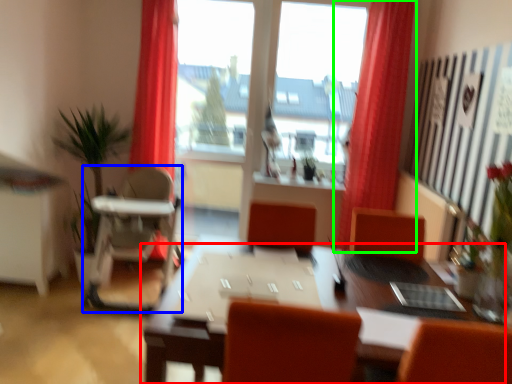
Question: Considering the real-world distances, which object is farthest from table (highlighted by a red box)? armchair (highlighted by a blue box) or curtain (highlighted by a green box)?

Choices:
 (A) armchair
 (B) curtain

Answer: (A)